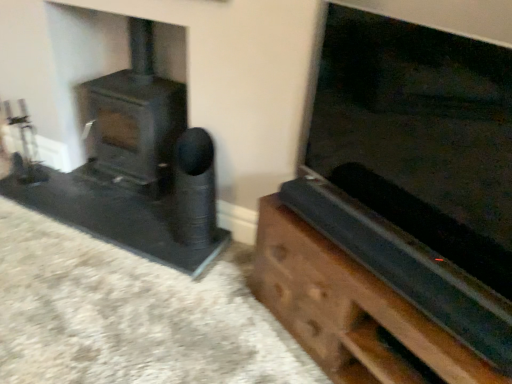
Identify the location of wooden chest at right. This screenshot has width=512, height=384. (349, 310).

The width and height of the screenshot is (512, 384). What do you see at coordinates (135, 121) in the screenshot?
I see `matte black wood burning stove at left` at bounding box center [135, 121].

I want to click on wooden chest at right, so click(x=349, y=310).

Would you say wooden chest at right is to the left or to the right of black matte speaker at center in the picture?

wooden chest at right is to the right of black matte speaker at center.

Considering the positions of points (381, 290) and (175, 167), is point (381, 290) farther from camera compared to point (175, 167)?

No.

From the image's perspective, is wooden chest at right located above or below black matte speaker at center?

wooden chest at right is below black matte speaker at center.

From a real-world perspective, is wooden chest at right physically below black matte speaker at center?

Yes, from a real-world perspective, wooden chest at right is beneath black matte speaker at center.

Is matte black wood burning stove at left to the right of black matte speaker at center from the viewer's perspective?

Incorrect, matte black wood burning stove at left is not on the right side of black matte speaker at center.

Between matte black wood burning stove at left and black matte speaker at center, which one has less height?

black matte speaker at center is shorter.

Can you confirm if matte black wood burning stove at left is bigger than black matte speaker at center?

Correct, matte black wood burning stove at left is larger in size than black matte speaker at center.

From the picture: Considering the sizes of objects matte black wood burning stove at left and black matte speaker at center in the image provided, who is wider, matte black wood burning stove at left or black matte speaker at center?

matte black wood burning stove at left.

Is wooden chest at right to the right of matte black wood burning stove at left from the viewer's perspective?

Yes, wooden chest at right is to the right of matte black wood burning stove at left.

Measure the distance between wooden chest at right and matte black wood burning stove at left.

The distance of wooden chest at right from matte black wood burning stove at left is 3.60 feet.

Is wooden chest at right in front of or behind matte black wood burning stove at left in the image?

Clearly, wooden chest at right is in front of matte black wood burning stove at left.

Is wooden chest at right outside of matte black wood burning stove at left?

Indeed, wooden chest at right is completely outside matte black wood burning stove at left.

From the picture: Which is farther from the camera, (137,29) or (354,281)?

Point (137,29)

In the scene shown: Is matte black wood burning stove at left facing towards wooden chest at right?

No, matte black wood burning stove at left is not oriented towards wooden chest at right.

Which object is more forward, matte black wood burning stove at left or wooden chest at right?

wooden chest at right is in front.

Which is more to the right, matte black wood burning stove at left or wooden chest at right?

Positioned to the right is wooden chest at right.

Is the surface of black matte speaker at center in direct contact with wooden chest at right?

They are not placed beside each other.

Considering the relative positions of black matte speaker at center and wooden chest at right in the image provided, is black matte speaker at center behind wooden chest at right?

Yes, the depth of black matte speaker at center is greater than that of wooden chest at right.

Can we say black matte speaker at center lies outside wooden chest at right?

Yes.

In the scene shown: Does black matte speaker at center have a greater width compared to matte black wood burning stove at left?

Incorrect, the width of black matte speaker at center does not surpass that of matte black wood burning stove at left.

Is black matte speaker at center behind matte black wood burning stove at left?

No, it is in front of matte black wood burning stove at left.

Where is `wood burning stove behind the black matte speaker at center`? wood burning stove behind the black matte speaker at center is located at coordinates (135, 121).

Image resolution: width=512 pixels, height=384 pixels. Identify the location of speaker on the left of wooden chest at right. (194, 189).

At what (x,y) coordinates should I click in order to perform the action: click on speaker in front of the matte black wood burning stove at left. Please return your answer as a coordinate pair (x, y). Looking at the image, I should click on (194, 189).

Estimate the real-world distances between objects in this image. Which object is further from wooden chest at right, matte black wood burning stove at left or black matte speaker at center?

Based on the image, matte black wood burning stove at left appears to be further to wooden chest at right.

Which object lies nearer to the anchor point wooden chest at right, black matte speaker at center or matte black wood burning stove at left?

The object closer to wooden chest at right is black matte speaker at center.

Which object lies nearer to the anchor point matte black wood burning stove at left, black matte speaker at center or wooden chest at right?

black matte speaker at center is positioned closer to the anchor matte black wood burning stove at left.

Which object lies further to the anchor point matte black wood burning stove at left, wooden chest at right or black matte speaker at center?

wooden chest at right.

Based on their spatial positions, is matte black wood burning stove at left or wooden chest at right further from black matte speaker at center?

wooden chest at right.

Estimate the real-world distances between objects in this image. Which object is closer to black matte speaker at center, wooden chest at right or matte black wood burning stove at left?

The object closer to black matte speaker at center is matte black wood burning stove at left.

At what (x,y) coordinates should I click in order to perform the action: click on speaker between matte black wood burning stove at left and wooden chest at right from left to right. Please return your answer as a coordinate pair (x, y). The image size is (512, 384). Looking at the image, I should click on (194, 189).